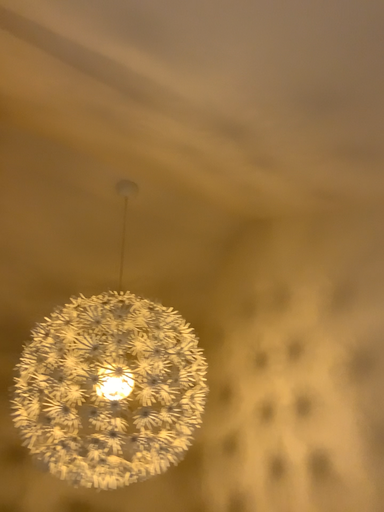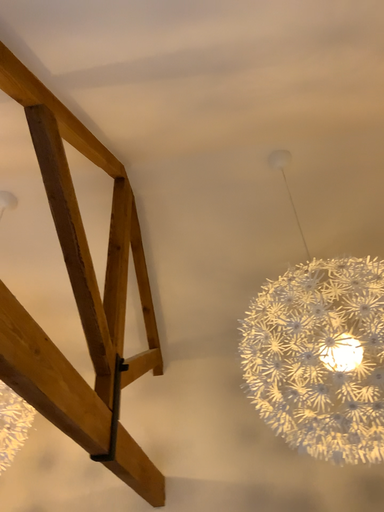
Question: Which way did the camera rotate in the video?

Choices:
 (A) rotated downward
 (B) rotated upward

Answer: (A)